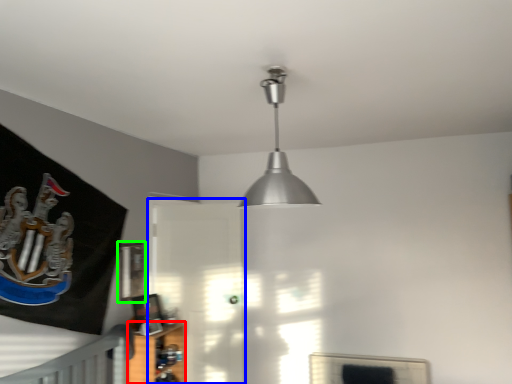
Question: Which object is the closest to the shelf (highlighted by a red box)? Choose among these: glass door (highlighted by a blue box) or picture frame (highlighted by a green box).

Choices:
 (A) glass door
 (B) picture frame

Answer: (B)